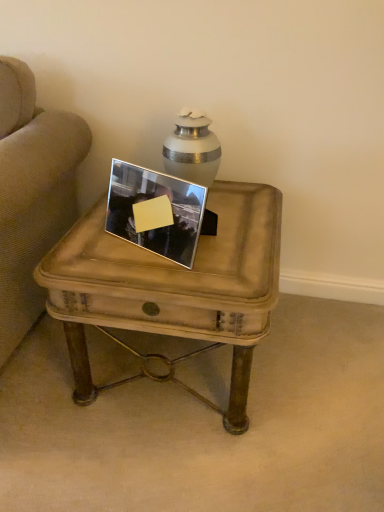
The width and height of the screenshot is (384, 512). In order to click on distressed wood coffee table at center in this screenshot , I will do `click(173, 286)`.

Describe the element at coordinates (173, 286) in the screenshot. I see `distressed wood coffee table at center` at that location.

This screenshot has width=384, height=512. Identify the location of silver metallic picture frame at center. (154, 211).

The image size is (384, 512). What do you see at coordinates (154, 211) in the screenshot?
I see `silver metallic picture frame at center` at bounding box center [154, 211].

This screenshot has height=512, width=384. What are the coordinates of `distressed wood coffee table at center` in the screenshot? It's located at (173, 286).

Between distressed wood coffee table at center and silver metallic picture frame at center, which one appears on the left side from the viewer's perspective?

From the viewer's perspective, silver metallic picture frame at center appears more on the left side.

Considering their positions, is distressed wood coffee table at center located in front of or behind silver metallic picture frame at center?

In the image, distressed wood coffee table at center appears in front of silver metallic picture frame at center.

Is point (116, 248) closer or farther from the camera than point (196, 191)?

Point (116, 248).

From the image's perspective, which one is positioned higher, distressed wood coffee table at center or silver metallic picture frame at center?

From the image's view, silver metallic picture frame at center is above.

From the picture: From a real-world perspective, is distressed wood coffee table at center physically below silver metallic picture frame at center?

Correct, in the physical world, distressed wood coffee table at center is lower than silver metallic picture frame at center.

Looking at this image, considering the sizes of distressed wood coffee table at center and silver metallic picture frame at center in the image, is distressed wood coffee table at center wider or thinner than silver metallic picture frame at center?

In the image, distressed wood coffee table at center appears to be wider than silver metallic picture frame at center.

Considering the sizes of objects distressed wood coffee table at center and silver metallic picture frame at center in the image provided, who is taller, distressed wood coffee table at center or silver metallic picture frame at center?

Standing taller between the two is distressed wood coffee table at center.

From the picture: Looking at the image, does distressed wood coffee table at center seem bigger or smaller compared to silver metallic picture frame at center?

Clearly, distressed wood coffee table at center is larger in size than silver metallic picture frame at center.

Is distressed wood coffee table at center spatially inside silver metallic picture frame at center, or outside of it?

distressed wood coffee table at center is outside silver metallic picture frame at center.

Is distressed wood coffee table at center far away from silver metallic picture frame at center?

That's not correct — distressed wood coffee table at center is a little close to silver metallic picture frame at center.

Is silver metallic picture frame at center at the back of distressed wood coffee table at center?

No, silver metallic picture frame at center is not at the back of distressed wood coffee table at center.

Can you tell me how much distressed wood coffee table at center and silver metallic picture frame at center differ in facing direction?

25.8 degrees.

How far apart are distressed wood coffee table at center and silver metallic picture frame at center?

distressed wood coffee table at center and silver metallic picture frame at center are 6.67 inches apart.

Where is `picture frame lying behind the distressed wood coffee table at center`? The width and height of the screenshot is (384, 512). picture frame lying behind the distressed wood coffee table at center is located at coordinates (154, 211).

In the image, is silver metallic picture frame at center on the left side or the right side of distressed wood coffee table at center?

From the image, it's evident that silver metallic picture frame at center is to the left of distressed wood coffee table at center.

Which is behind, silver metallic picture frame at center or distressed wood coffee table at center?

silver metallic picture frame at center.

Is point (111, 166) positioned before point (177, 267)?

That is False.

From the image's perspective, does silver metallic picture frame at center appear higher than distressed wood coffee table at center?

Yes, from the image's perspective, silver metallic picture frame at center is over distressed wood coffee table at center.

From a real-world perspective, is silver metallic picture frame at center physically located above or below distressed wood coffee table at center?

silver metallic picture frame at center is situated higher than distressed wood coffee table at center in the real world.

Which of these two, silver metallic picture frame at center or distressed wood coffee table at center, is wider?

Wider between the two is distressed wood coffee table at center.

From the picture: Who is shorter, silver metallic picture frame at center or distressed wood coffee table at center?

Standing shorter between the two is silver metallic picture frame at center.

Can you confirm if silver metallic picture frame at center is bigger than distressed wood coffee table at center?

No.

Is distressed wood coffee table at center surrounded by silver metallic picture frame at center?

No, distressed wood coffee table at center is located outside of silver metallic picture frame at center.

Is silver metallic picture frame at center touching distressed wood coffee table at center?

No, silver metallic picture frame at center is not with distressed wood coffee table at center.

Could you tell me if silver metallic picture frame at center is facing distressed wood coffee table at center?

No, silver metallic picture frame at center does not turn towards distressed wood coffee table at center.

Where is `picture frame lying above the distressed wood coffee table at center (from the image's perspective)`? The height and width of the screenshot is (512, 384). picture frame lying above the distressed wood coffee table at center (from the image's perspective) is located at coordinates (154, 211).

The width and height of the screenshot is (384, 512). Find the location of `picture frame behind the distressed wood coffee table at center`. picture frame behind the distressed wood coffee table at center is located at coordinates (154, 211).

Locate an element on the screen. Image resolution: width=384 pixels, height=512 pixels. picture frame located above the distressed wood coffee table at center (from a real-world perspective) is located at coordinates (154, 211).